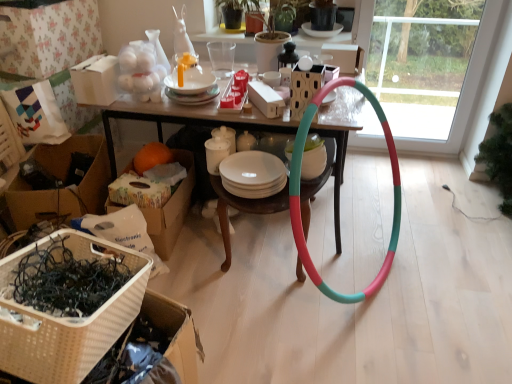
Question: Can you confirm if white paper bag at upper left, the 2th box when ordered from front to back, is taller than white woven basket at lower left?

Choices:
 (A) no
 (B) yes

Answer: (B)

Question: From the image's perspective, would you say white paper bag at upper left, arranged as the third box when ordered from the bottom, is shown under white woven basket at lower left?

Choices:
 (A) no
 (B) yes

Answer: (A)

Question: Is white paper bag at upper left, which ranks as the first box in top-to-bottom order, positioned behind white woven basket at lower left?

Choices:
 (A) no
 (B) yes

Answer: (B)

Question: Does white paper bag at upper left, the 1th box positioned from the left, have a lesser height compared to white woven basket at lower left?

Choices:
 (A) no
 (B) yes

Answer: (A)

Question: Is white paper bag at upper left, which ranks as the first box in top-to-bottom order, to the right of white woven basket at lower left from the viewer's perspective?

Choices:
 (A) no
 (B) yes

Answer: (A)

Question: In the image, is transparent glass door at center on the left side or the right side of white woven basket at lower left?

Choices:
 (A) left
 (B) right

Answer: (B)

Question: Considering the positions of transparent glass door at center and white woven basket at lower left in the image, is transparent glass door at center bigger or smaller than white woven basket at lower left?

Choices:
 (A) big
 (B) small

Answer: (A)

Question: In terms of width, does transparent glass door at center look wider or thinner when compared to white woven basket at lower left?

Choices:
 (A) wide
 (B) thin

Answer: (B)

Question: From the image's perspective, is transparent glass door at center positioned above or below white woven basket at lower left?

Choices:
 (A) above
 (B) below

Answer: (A)

Question: In the image, is matte white rectangular box at center, arranged as the first box when ordered from the bottom, positioned in front of or behind white cardboard box at upper left, which is the 2th cardboard box from left to right?

Choices:
 (A) behind
 (B) front

Answer: (B)

Question: Is point (270, 104) closer or farther from the camera than point (111, 92)?

Choices:
 (A) closer
 (B) farther

Answer: (A)

Question: Is matte white rectangular box at center, marked as the 1th box in a front-to-back arrangement, spatially inside white cardboard box at upper left, which is the 2th cardboard box from left to right, or outside of it?

Choices:
 (A) outside
 (B) inside

Answer: (A)

Question: In terms of width, does matte white rectangular box at center, arranged as the third box when viewed from the back, look wider or thinner when compared to white cardboard box at upper left, which is the second cardboard box in right-to-left order?

Choices:
 (A) thin
 (B) wide

Answer: (B)

Question: Based on their positions, is wooden table at center located to the left or right of transparent glass door at center?

Choices:
 (A) left
 (B) right

Answer: (A)

Question: Is point (162, 117) positioned closer to the camera than point (403, 61)?

Choices:
 (A) farther
 (B) closer

Answer: (B)